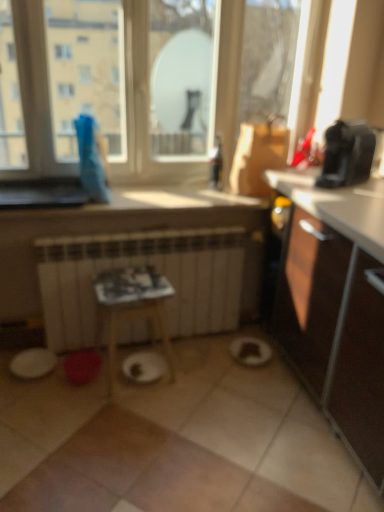
Locate an element on the screen. vacant region below white matte radiator at center (from a real-world perspective) is located at coordinates (168, 338).